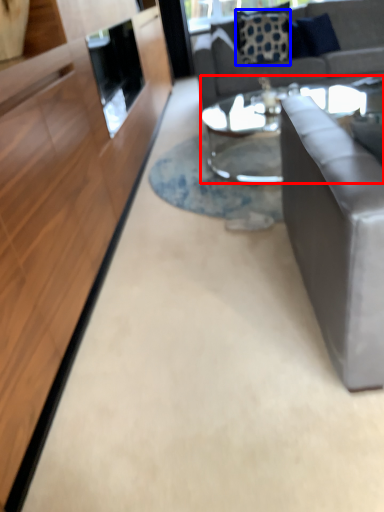
Question: Which point is closer to the camera, coffee table (highlighted by a red box) or pillow (highlighted by a blue box)?

Choices:
 (A) coffee table
 (B) pillow

Answer: (A)